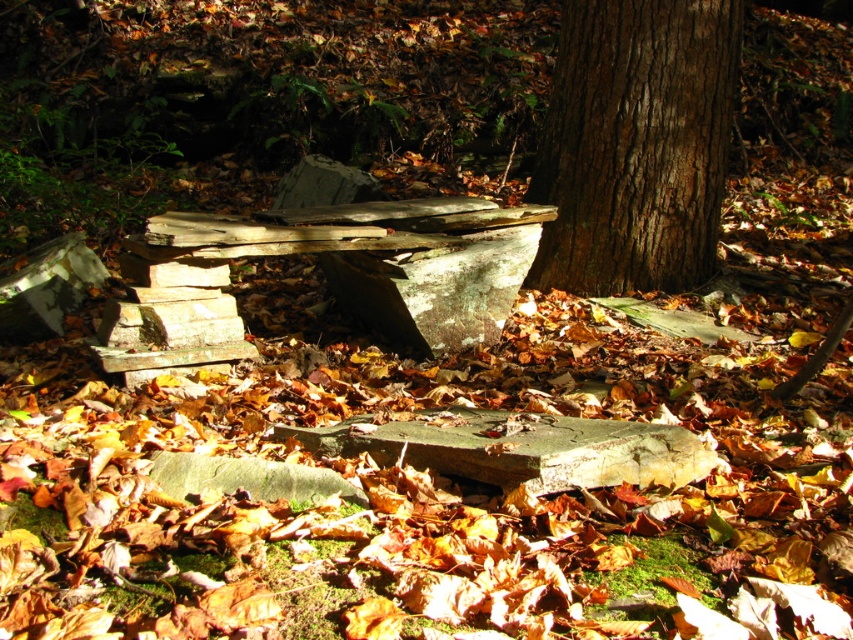
Is brown rough bark tree at center to the left of gray rough stone at center from the viewer's perspective?

No, brown rough bark tree at center is not to the left of gray rough stone at center.

Looking at this image, between brown rough bark tree at center and gray rough stone at center, which one has less height?

Standing shorter between the two is gray rough stone at center.

Who is more distant from viewer, [714,144] or [321,468]?

The point [714,144] is behind.

Where is `brown rough bark tree at center`? Image resolution: width=853 pixels, height=640 pixels. brown rough bark tree at center is located at coordinates (635, 145).

Does green weathered stone at center have a greater width compared to gray rough stone at center?

Correct, the width of green weathered stone at center exceeds that of gray rough stone at center.

Does point (686, 452) come in front of point (171, 452)?

No, (686, 452) is further to viewer.

Identify the location of green weathered stone at center. (520, 449).

From the picture: Between brown rough bark tree at center and green weathered stone at center, which one appears on the left side from the viewer's perspective?

From the viewer's perspective, green weathered stone at center appears more on the left side.

Can you confirm if brown rough bark tree at center is thinner than green weathered stone at center?

Yes.

At what (x,y) coordinates should I click in order to perform the action: click on brown rough bark tree at center. Please return your answer as a coordinate pair (x, y). Looking at the image, I should click on (635, 145).

Image resolution: width=853 pixels, height=640 pixels. In order to click on brown rough bark tree at center in this screenshot , I will do point(635,145).